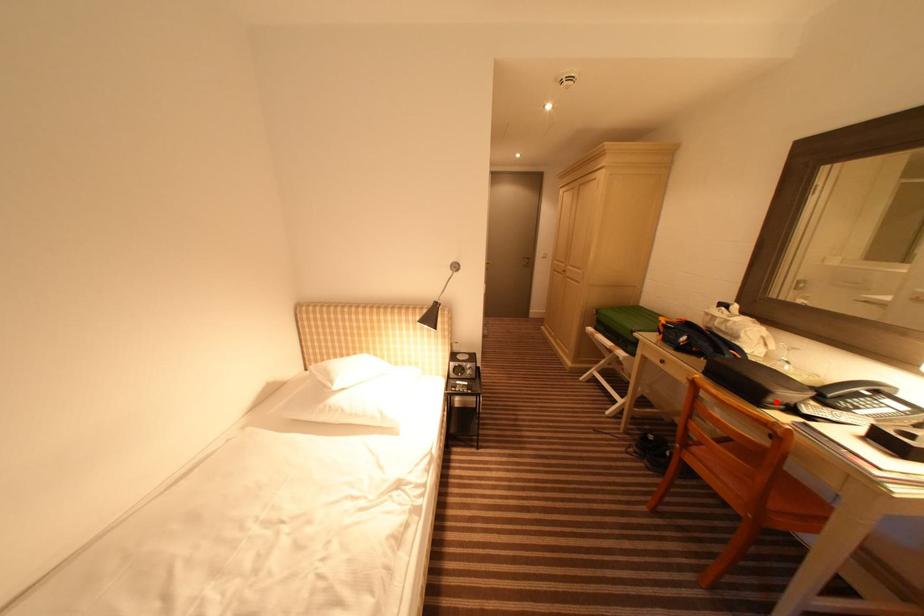
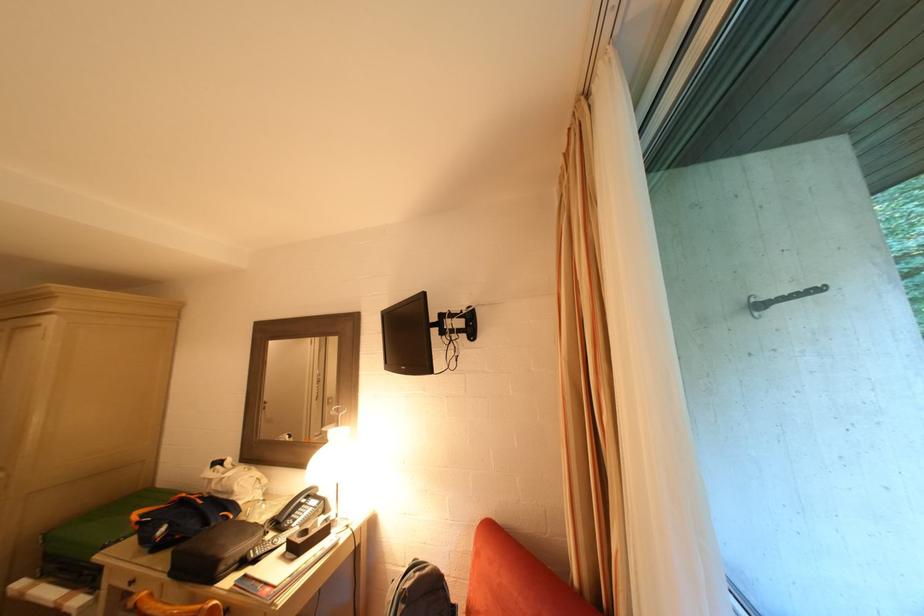
Question: I am providing you with two images of the same scene from different viewpoints. Given a red point in image1, look at the same physical point in image2. Is it:

Choices:
 (A) Closer to the viewpoint
 (B) Farther from the viewpoint

Answer: (A)